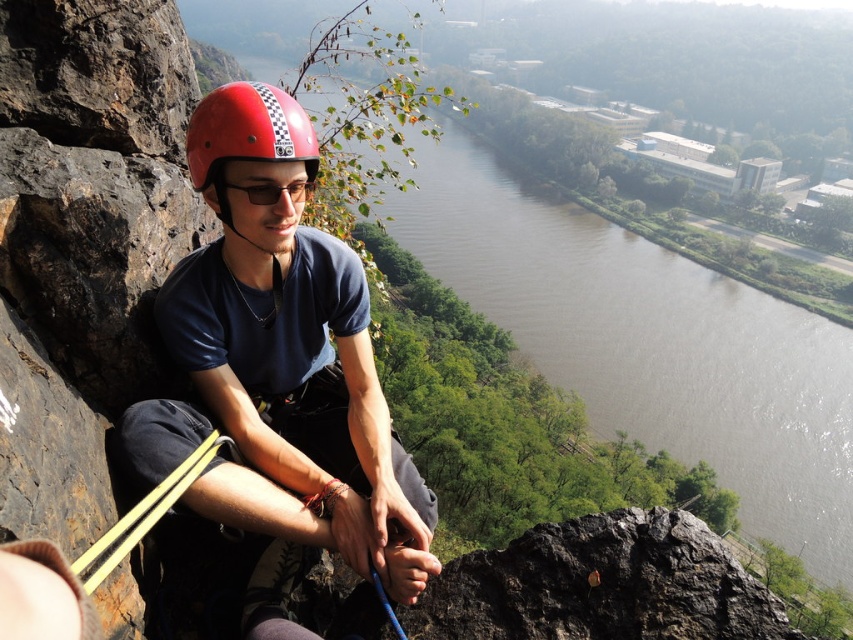
Between point (312, 316) and point (212, 164), which one is positioned behind?

Positioned behind is point (312, 316).

Which of these two, matte red helmet at left or matte red helmet at center, stands taller?

matte red helmet at left

The height and width of the screenshot is (640, 853). I want to click on matte red helmet at left, so click(279, 362).

Is brown water at center shorter than matte red helmet at left?

No.

The width and height of the screenshot is (853, 640). What do you see at coordinates (650, 342) in the screenshot?
I see `brown water at center` at bounding box center [650, 342].

At what (x,y) coordinates should I click in order to perform the action: click on brown water at center. Please return your answer as a coordinate pair (x, y). The height and width of the screenshot is (640, 853). Looking at the image, I should click on (650, 342).

You are a GUI agent. You are given a task and a screenshot of the screen. Output one action in this format:
    pyautogui.click(x=<x>, y=<y>)
    Task: Click on the brown water at center
    Image resolution: width=853 pixels, height=640 pixels.
    Given the screenshot: What is the action you would take?
    pyautogui.click(x=650, y=342)

Who is more distant from viewer, (514, 321) or (294, 109)?

Point (514, 321)

Is point (850, 424) positioned before point (299, 140)?

No, (850, 424) is behind (299, 140).

The width and height of the screenshot is (853, 640). I want to click on brown water at center, so click(650, 342).